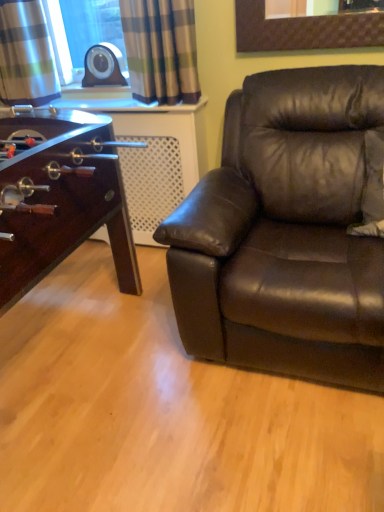
Question: Can you confirm if brown leather couch at right is wider than plaid fabric curtain at upper left, the 2th curtain from the right?

Choices:
 (A) no
 (B) yes

Answer: (B)

Question: Does brown leather couch at right have a larger size compared to plaid fabric curtain at upper left, the 2th curtain from the right?

Choices:
 (A) no
 (B) yes

Answer: (B)

Question: Is brown leather couch at right to the right of plaid fabric curtain at upper left, which is counted as the 1th curtain, starting from the left, from the viewer's perspective?

Choices:
 (A) no
 (B) yes

Answer: (B)

Question: Is brown leather couch at right shorter than plaid fabric curtain at upper left, the 2th curtain from the right?

Choices:
 (A) no
 (B) yes

Answer: (A)

Question: Considering the relative sizes of brown leather couch at right and plaid fabric curtain at upper left, the 2th curtain from the right, in the image provided, is brown leather couch at right taller than plaid fabric curtain at upper left, the 2th curtain from the right,?

Choices:
 (A) yes
 (B) no

Answer: (A)

Question: In the image, is plaid fabric curtain at upper left, the 2th curtain from the right, on the left side or the right side of plaid fabric curtain at upper left, acting as the 1th curtain starting from the right?

Choices:
 (A) left
 (B) right

Answer: (A)

Question: From the image's perspective, is plaid fabric curtain at upper left, the 2th curtain from the right, above or below plaid fabric curtain at upper left, acting as the 1th curtain starting from the right?

Choices:
 (A) above
 (B) below

Answer: (A)

Question: Is point (18, 8) positioned closer to the camera than point (157, 24)?

Choices:
 (A) closer
 (B) farther

Answer: (B)

Question: Based on their sizes in the image, would you say plaid fabric curtain at upper left, which is counted as the 1th curtain, starting from the left, is bigger or smaller than plaid fabric curtain at upper left, positioned as the second curtain in left-to-right order?

Choices:
 (A) big
 (B) small

Answer: (A)

Question: From the image's perspective, is plaid fabric curtain at upper left, the 2th curtain from the right, positioned above or below brown leather couch at right?

Choices:
 (A) below
 (B) above

Answer: (B)

Question: Looking at the image, does plaid fabric curtain at upper left, which is counted as the 1th curtain, starting from the left, seem bigger or smaller compared to brown leather couch at right?

Choices:
 (A) small
 (B) big

Answer: (A)

Question: Relative to brown leather couch at right, is plaid fabric curtain at upper left, the 2th curtain from the right, in front or behind?

Choices:
 (A) front
 (B) behind

Answer: (B)

Question: Does point (56, 76) appear closer or farther from the camera than point (228, 157)?

Choices:
 (A) closer
 (B) farther

Answer: (B)

Question: In terms of width, does plaid fabric curtain at upper left, acting as the 1th curtain starting from the right, look wider or thinner when compared to plaid fabric curtain at upper left, the 2th curtain from the right?

Choices:
 (A) wide
 (B) thin

Answer: (B)

Question: Relative to plaid fabric curtain at upper left, which is counted as the 1th curtain, starting from the left, is plaid fabric curtain at upper left, positioned as the second curtain in left-to-right order, in front or behind?

Choices:
 (A) behind
 (B) front

Answer: (B)